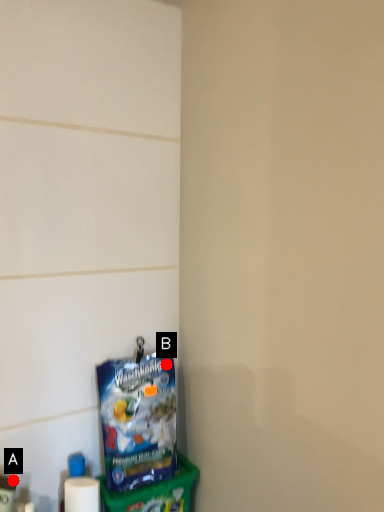
Question: Two points are circled on the image, labeled by A and B beside each circle. Among these points, which one is farthest from the camera?

Choices:
 (A) A is further
 (B) B is further

Answer: (B)